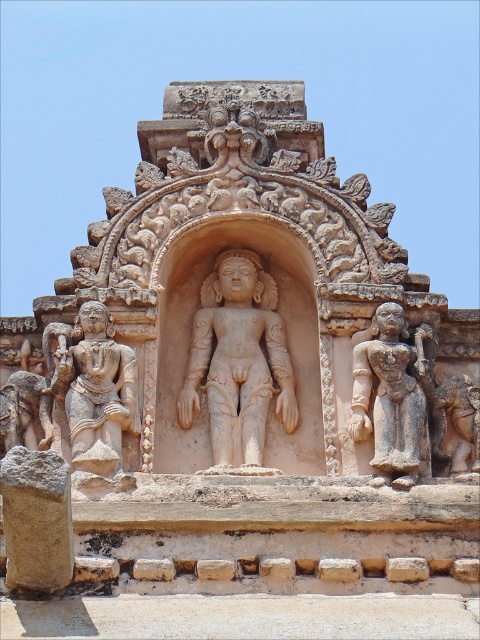
Question: Is beige stone statue at center smaller than gray stone statue at right?

Choices:
 (A) yes
 (B) no

Answer: (B)

Question: Can you confirm if beige stone statue at center is positioned to the right of stone statue at left?

Choices:
 (A) no
 (B) yes

Answer: (B)

Question: Based on their relative distances, which object is nearer to the stone statue at left?

Choices:
 (A) gray stone statue at right
 (B) beige stone statue at center

Answer: (B)

Question: Among these objects, which one is nearest to the camera?

Choices:
 (A) beige stone statue at center
 (B) stone statue at left

Answer: (B)

Question: Is beige stone statue at center to the left of gray stone statue at right from the viewer's perspective?

Choices:
 (A) yes
 (B) no

Answer: (A)

Question: Estimate the real-world distances between objects in this image. Which object is farther from the stone statue at left?

Choices:
 (A) gray stone statue at right
 (B) beige stone statue at center

Answer: (A)